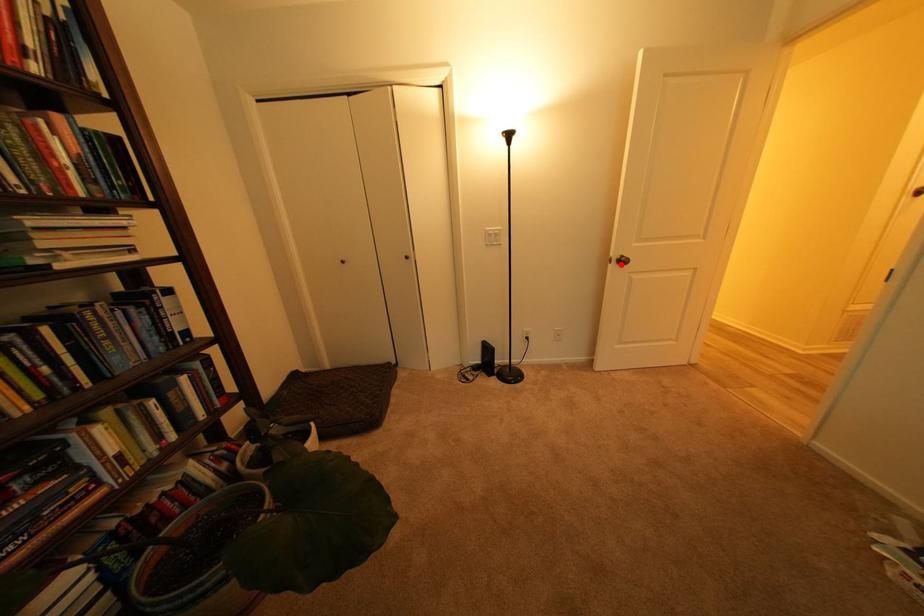
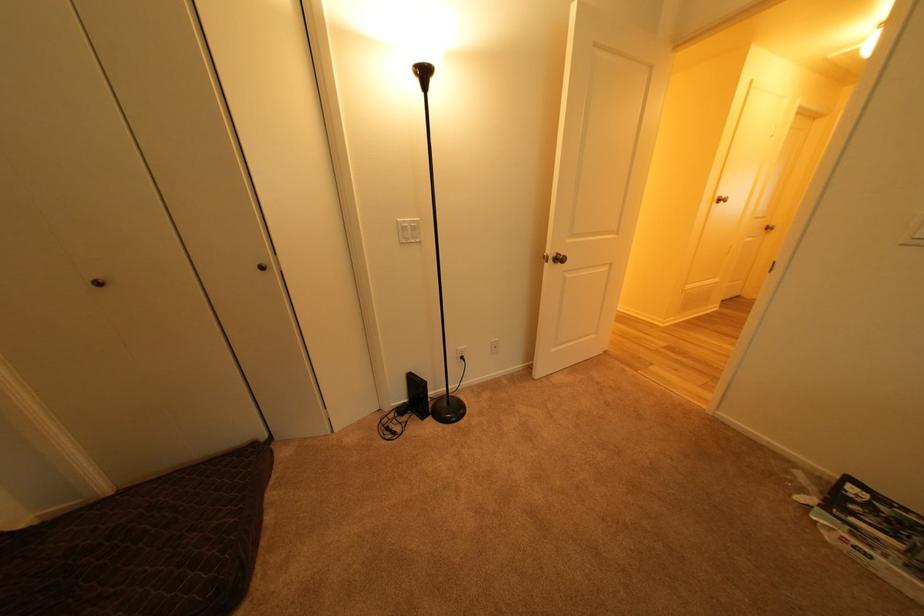
Locate, in the second image, the point that corresponds to the highlighted location in the first image.

(557, 264)